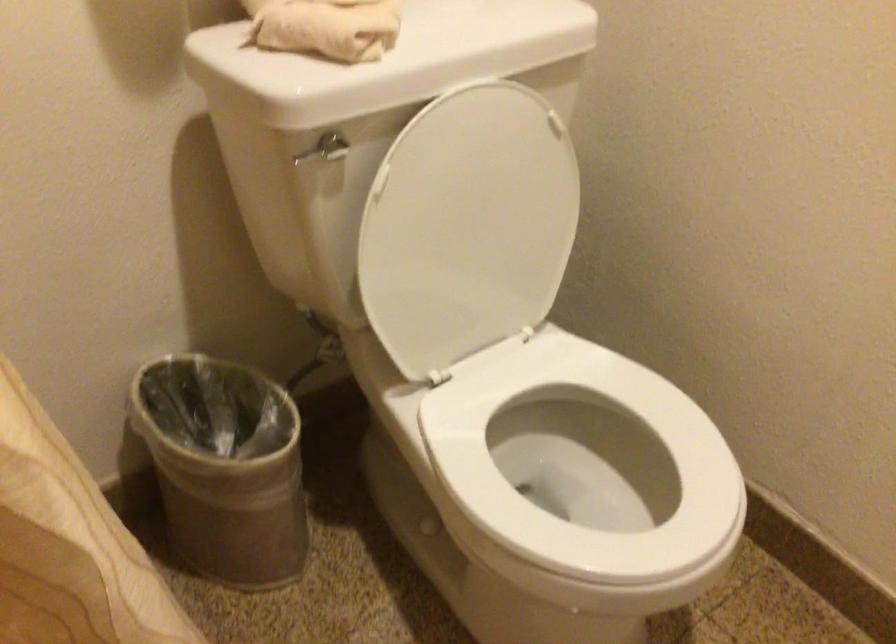
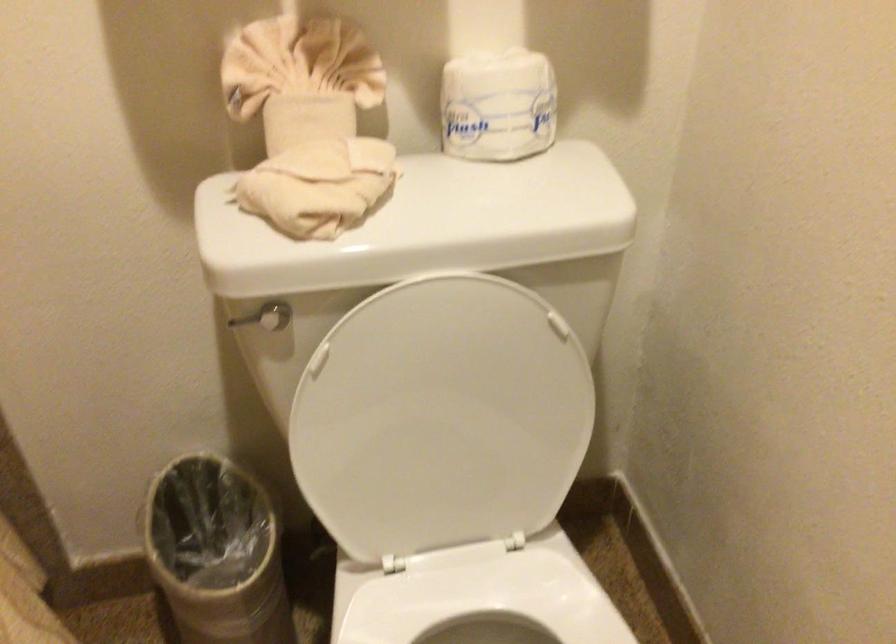
Question: The camera is either moving clockwise (left) or counter-clockwise (right) around the object. The first image is from the beginning of the video and the second image is from the end. Is the camera moving left or right when shooting the video?

Choices:
 (A) Left
 (B) Right

Answer: (B)